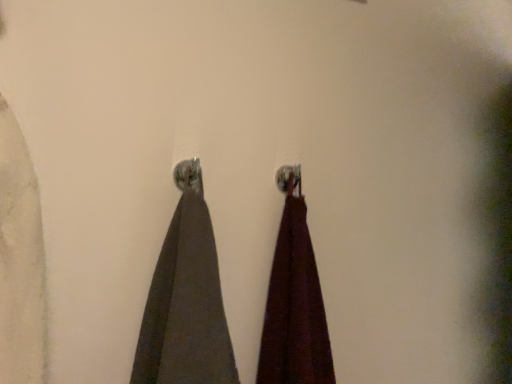
Question: Visually, is dark gray fabric at center, acting as the second curtain starting from the right, positioned to the left or to the right of burgundy fabric at center, the second curtain in the left-to-right sequence?

Choices:
 (A) left
 (B) right

Answer: (A)

Question: Considering the positions of dark gray fabric at center, the first curtain in the left-to-right sequence, and burgundy fabric at center, the second curtain in the left-to-right sequence, in the image, is dark gray fabric at center, the first curtain in the left-to-right sequence, taller or shorter than burgundy fabric at center, the second curtain in the left-to-right sequence,?

Choices:
 (A) short
 (B) tall

Answer: (A)

Question: Is dark gray fabric at center, acting as the second curtain starting from the right, bigger or smaller than burgundy fabric at center, the 1th curtain viewed from the right?

Choices:
 (A) small
 (B) big

Answer: (B)

Question: Considering their positions, is burgundy fabric at center, the second curtain in the left-to-right sequence, located in front of or behind dark gray fabric at center, acting as the second curtain starting from the right?

Choices:
 (A) behind
 (B) front

Answer: (A)

Question: In terms of width, does burgundy fabric at center, the 1th curtain viewed from the right, look wider or thinner when compared to dark gray fabric at center, the first curtain in the left-to-right sequence?

Choices:
 (A) thin
 (B) wide

Answer: (B)

Question: From a real-world perspective, is burgundy fabric at center, the second curtain in the left-to-right sequence, positioned above or below dark gray fabric at center, acting as the second curtain starting from the right?

Choices:
 (A) below
 (B) above

Answer: (A)

Question: Is burgundy fabric at center, the 1th curtain viewed from the right, taller or shorter than dark gray fabric at center, acting as the second curtain starting from the right?

Choices:
 (A) short
 (B) tall

Answer: (B)